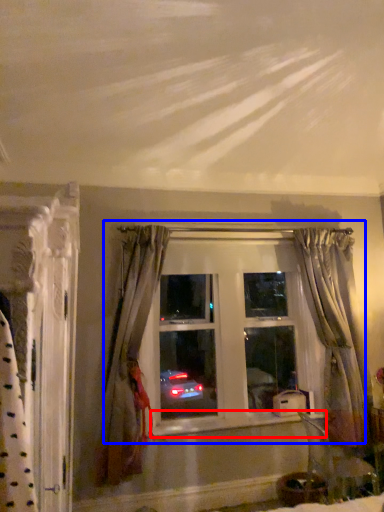
Question: Which point is further to the camera, window sill (highlighted by a red box) or window (highlighted by a blue box)?

Choices:
 (A) window sill
 (B) window

Answer: (B)